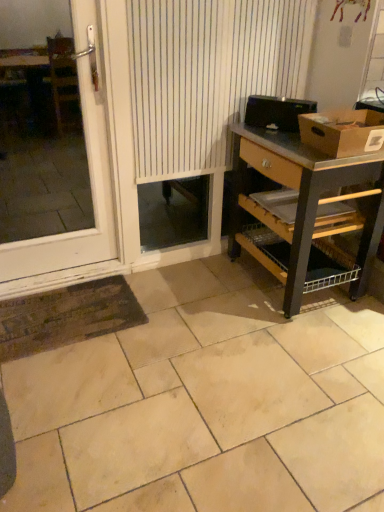
You are a GUI agent. You are given a task and a screenshot of the screen. Output one action in this format:
    pyautogui.click(x=<x>, y=<y>)
    Task: Click on the free space in front of wooden desk at right
    
    Given the screenshot: What is the action you would take?
    pyautogui.click(x=296, y=347)